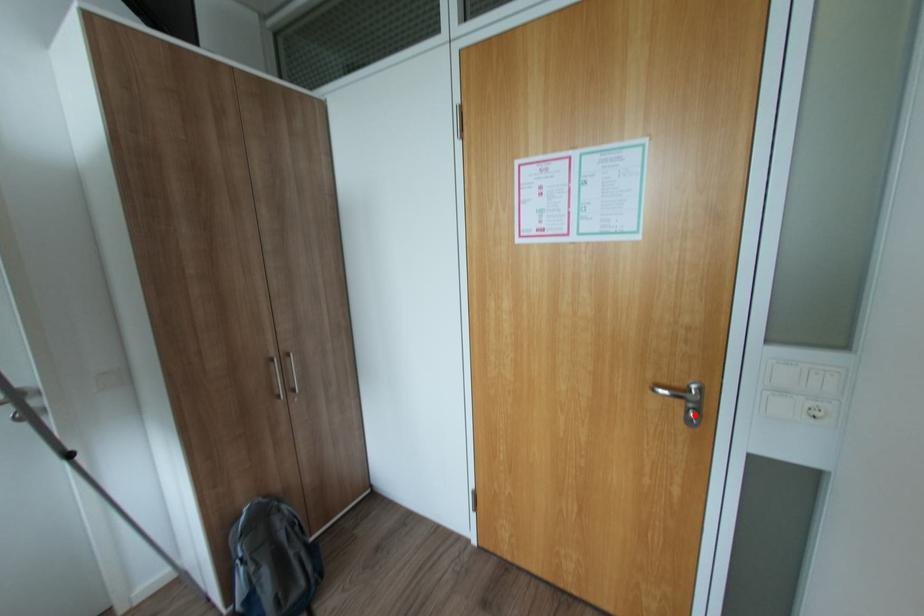
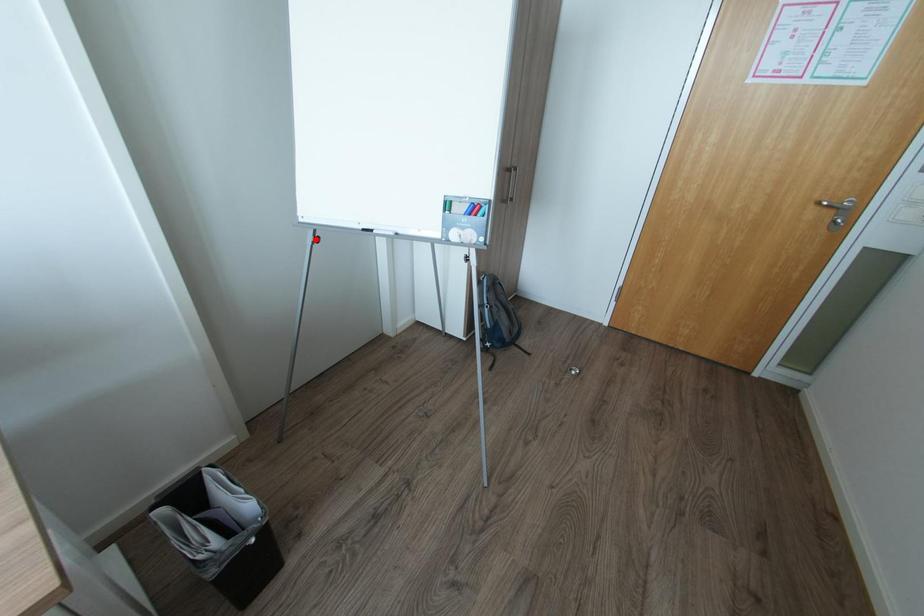
I am providing you with two images of the same scene from different viewpoints. A red point is marked on the first image and another point is marked on the second image. Are the points marked in image1 and image2 representing the same 3D position?

No